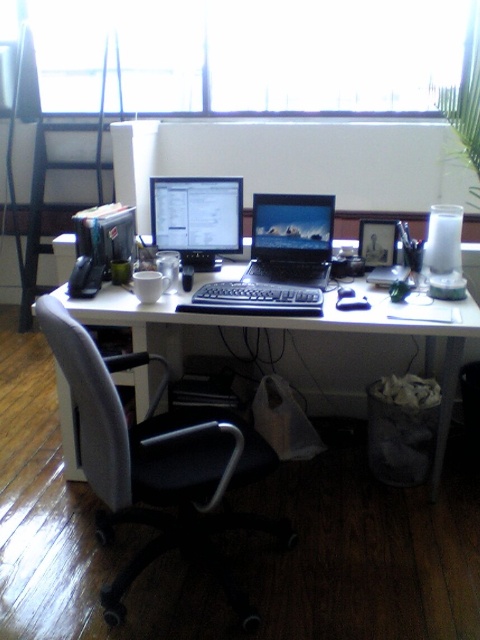
You are organizing a small meeting in the home office and need to place a 12x12 inch square table between the gray fabric swivel chair at center and the shiny black laptop at center. Considering their sizes, will the table fit comfortably between them?

The gray fabric swivel chair at center is larger in size than the shiny black laptop at center. Since the chair is bigger, there might not be enough space for a 12x12 inch table between them unless they are positioned apart. However, the exact distance isn

You are sitting in the gray fabric swivel chair at center and want to reach the shiny black laptop at center on the desk. Based on the scene description, which object is closer to you, the chair or the laptop?

The gray fabric swivel chair at center is closer to the viewer than the shiny black laptop at center, so the chair is closer to you.

You are sitting at the desk in the home office and want to reach both the point at coordinates (x=74, y=93) and the point at coordinates (x=228, y=236). Which point is closer to you?

Point (x=228, y=236) is closer to you because it is in front of point (x=74, y=93).